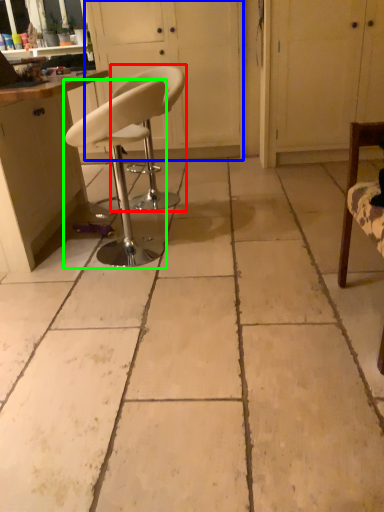
Question: Which is farther away from chair (highlighted by a red box)? screen door (highlighted by a blue box) or chair (highlighted by a green box)?

Choices:
 (A) screen door
 (B) chair

Answer: (A)